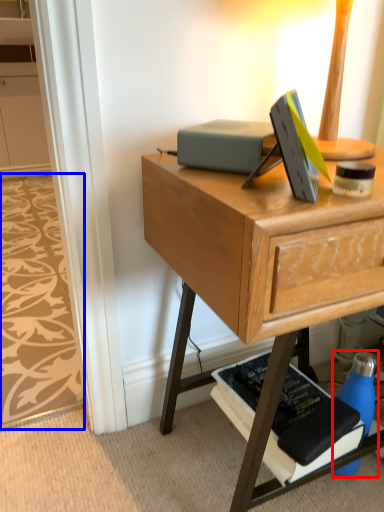
Question: Which of the following is the closest to the observer, bottle (highlighted by a red box) or pattern (highlighted by a blue box)?

Choices:
 (A) bottle
 (B) pattern

Answer: (A)